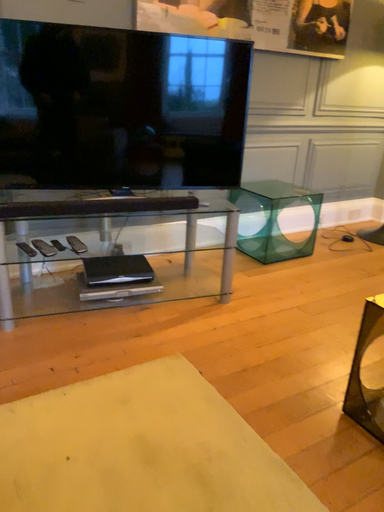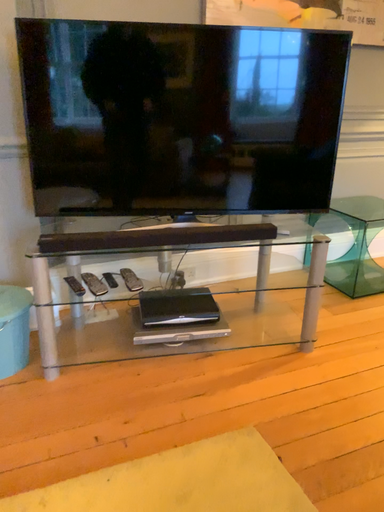
Question: Which way did the camera rotate in the video?

Choices:
 (A) rotated left
 (B) rotated right

Answer: (A)